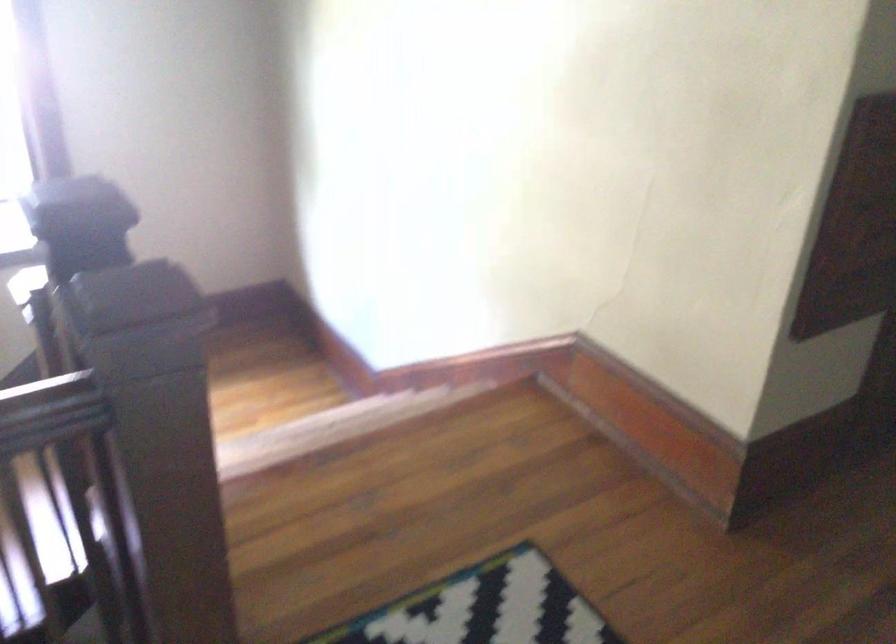
This screenshot has height=644, width=896. What do you see at coordinates (50, 413) in the screenshot?
I see `the wooden handrail` at bounding box center [50, 413].